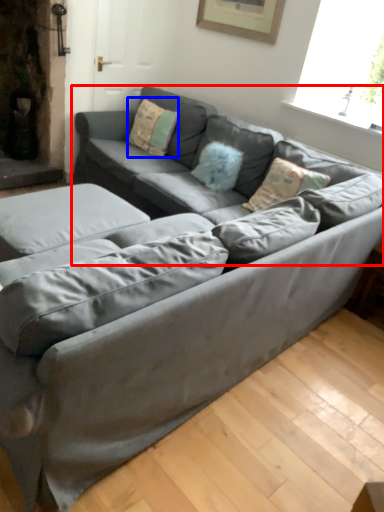
Question: Among these objects, which one is farthest to the camera, couch (highlighted by a red box) or pillow (highlighted by a blue box)?

Choices:
 (A) couch
 (B) pillow

Answer: (B)